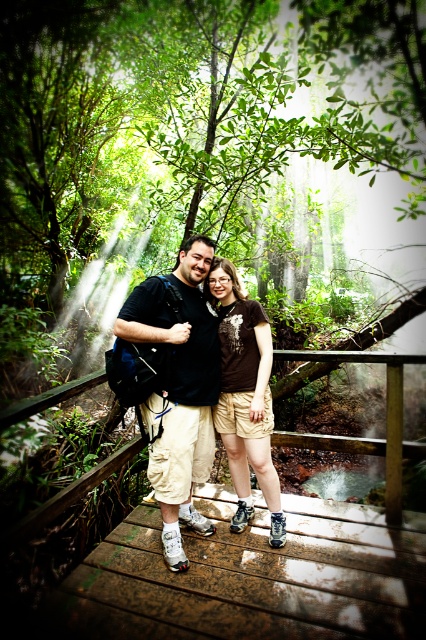
Question: Which of the following is the farthest from the observer?

Choices:
 (A) (178, 275)
 (B) (244, 481)
 (C) (374, 516)

Answer: (B)

Question: Which of the following is the farthest from the observer?

Choices:
 (A) (247, 596)
 (B) (239, 333)
 (C) (183, 445)

Answer: (B)

Question: Considering the real-world distances, which object is closest to the brown fabric shorts at center?

Choices:
 (A) matte black t-shirt at center
 (B) brown wooden bridge at center

Answer: (A)

Question: Is brown wooden bridge at center smaller than brown fabric shorts at center?

Choices:
 (A) yes
 (B) no

Answer: (B)

Question: Is matte black t-shirt at center further to camera compared to brown fabric shorts at center?

Choices:
 (A) yes
 (B) no

Answer: (B)

Question: Does matte black t-shirt at center appear on the left side of brown fabric shorts at center?

Choices:
 (A) no
 (B) yes

Answer: (B)